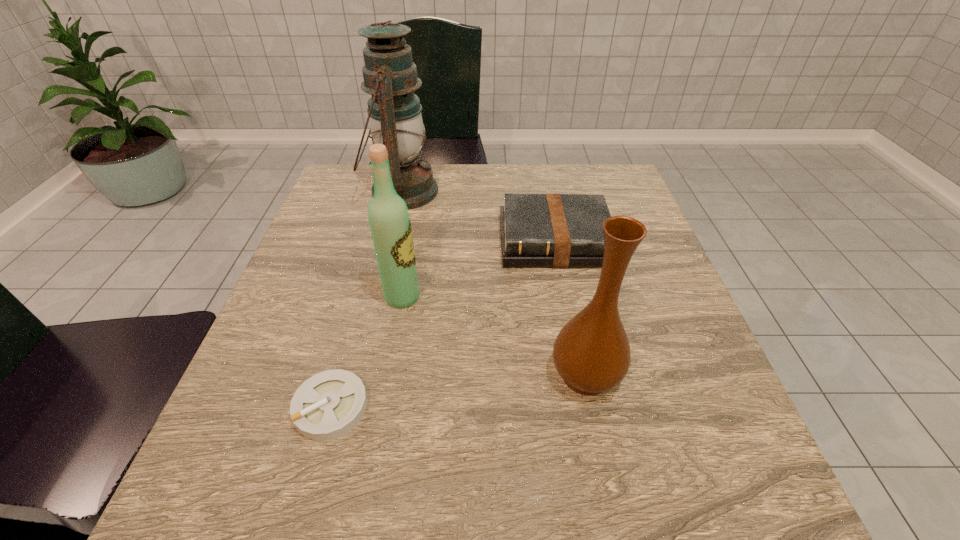
Find the location of a particular element. the tallest object is located at coordinates (394, 112).

This screenshot has width=960, height=540. I want to click on wine bottle, so [390, 225].

This screenshot has width=960, height=540. I want to click on vase, so click(591, 353).

Where is `hardback book`? The height and width of the screenshot is (540, 960). hardback book is located at coordinates (537, 230).

The image size is (960, 540). What are the coordinates of `ashtray` in the screenshot? It's located at (328, 405).

I want to click on free space located on the right of the tallest object, so click(491, 192).

You are a GUI agent. You are given a task and a screenshot of the screen. Output one action in this format:
    pyautogui.click(x=<x>, y=<y>)
    Task: Click on the free region located on the front-facing side of the wine bottle
    
    Given the screenshot: What is the action you would take?
    pyautogui.click(x=559, y=297)

Where is `blank space located 0.210m on the left of the vase`? blank space located 0.210m on the left of the vase is located at coordinates [x=427, y=375].

Where is `free space located 0.280m on the spine side of the hardback book`? Image resolution: width=960 pixels, height=540 pixels. free space located 0.280m on the spine side of the hardback book is located at coordinates (583, 380).

The height and width of the screenshot is (540, 960). Identify the location of free space located 0.270m on the back of the shortest object. (369, 271).